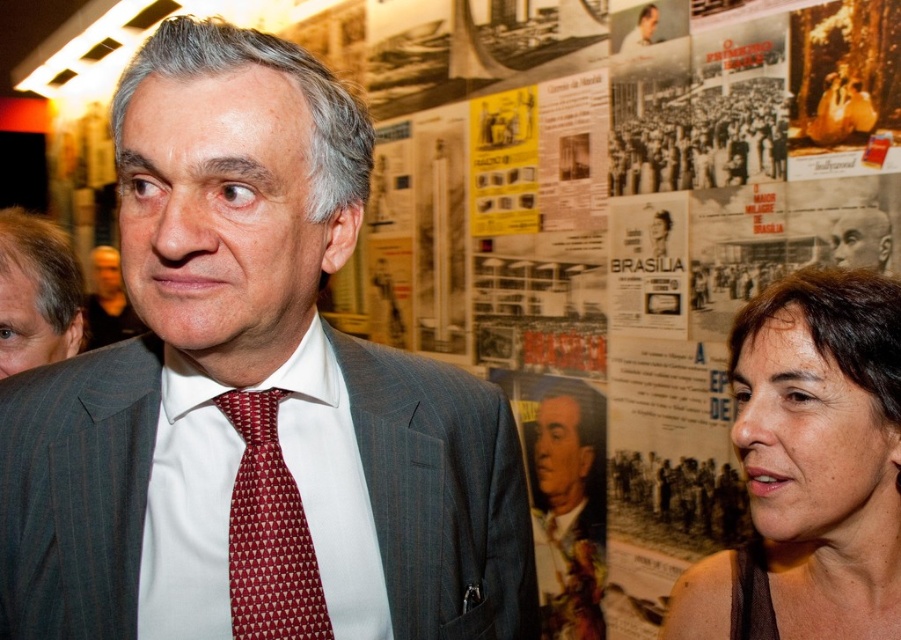
Is point (792, 525) in front of point (314, 595)?

No, (792, 525) is further to viewer.

Between brown fabric at right and red textured tie at center, which one appears on the right side from the viewer's perspective?

From the viewer's perspective, brown fabric at right appears more on the right side.

Is point (899, 481) closer to camera compared to point (262, 637)?

No, it is not.

This screenshot has height=640, width=901. I want to click on brown fabric at right, so click(808, 468).

Which is behind, point (255, 435) or point (652, 40)?

Point (652, 40)

Can you confirm if red textured tie at center is positioned to the left of smooth white shirt at upper center?

Yes, red textured tie at center is to the left of smooth white shirt at upper center.

You are a GUI agent. You are given a task and a screenshot of the screen. Output one action in this format:
    pyautogui.click(x=<x>, y=<y>)
    Task: Click on the red textured tie at center
    Image resolution: width=901 pixels, height=640 pixels.
    Given the screenshot: What is the action you would take?
    pyautogui.click(x=268, y=532)

Between smooth dark suit at center and smooth white shirt at upper center, which one is positioned higher?

smooth white shirt at upper center is above.

Is point (595, 497) in front of point (643, 29)?

That is False.

What do you see at coordinates (569, 504) in the screenshot? I see `smooth dark suit at center` at bounding box center [569, 504].

Image resolution: width=901 pixels, height=640 pixels. What are the coordinates of `smooth dark suit at center` in the screenshot? It's located at (569, 504).